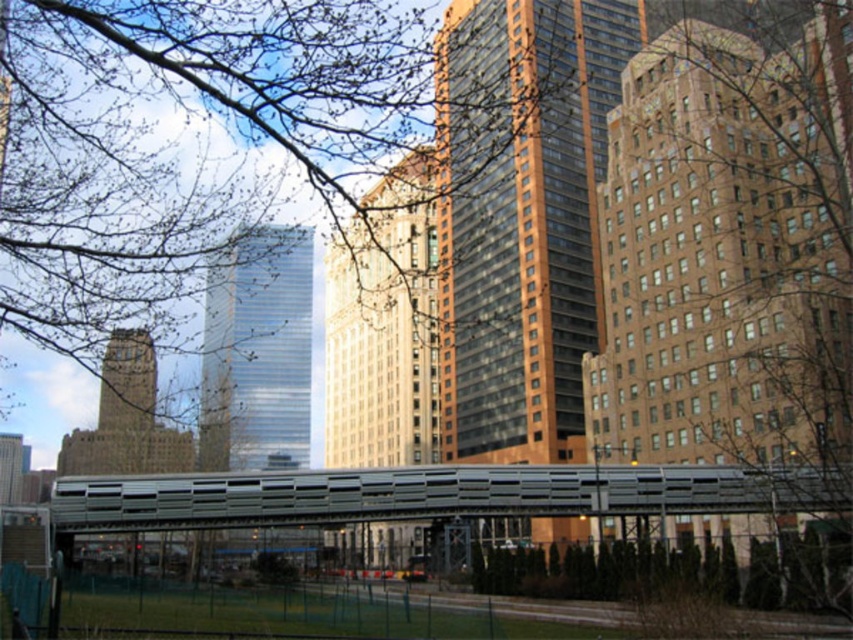
You are a drone operator planning to fly a drone from the green grass at lower center to the metallic gray bridge at center. Based on the scene description, can you determine if the drone will need to ascend or descend to reach its destination?

The metallic gray bridge at center is located above the green grass at lower center, so the drone will need to ascend to reach it.

You are a city planner evaluating the image to assess green space distribution. The scene includes a pedestrian bridge with a metallic grid structure in the foreground and a fence separating the park from urban buildings in the midground. You notice the bare branches at upper center and the green grass at lower center. Which of these two elements occupies a larger area in the image?

The bare branches at upper center occupies a larger area in the image than the green grass at lower center.

Based on the scene description, where exactly is the bare branches at upper center located in terms of coordinates?

The bare branches at upper center are located at coordinates point (177, 164).